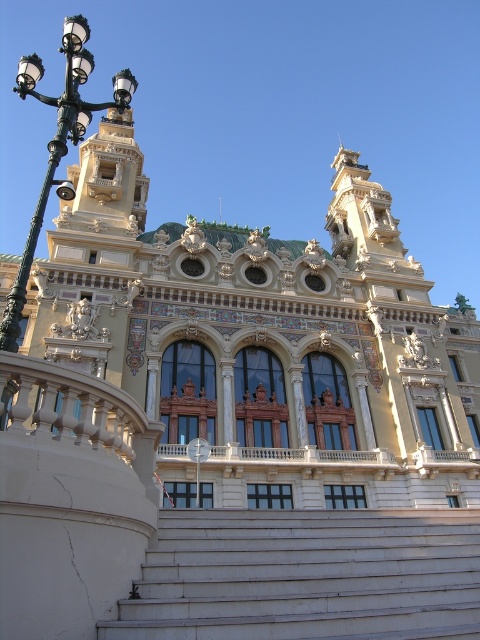
Between white marble stairs at center and black metal streetlight at left, which one has more height?

black metal streetlight at left is taller.

Does white marble stairs at center have a lesser height compared to black metal streetlight at left?

Yes.

The height and width of the screenshot is (640, 480). What are the coordinates of `white marble stairs at center` in the screenshot? It's located at (305, 577).